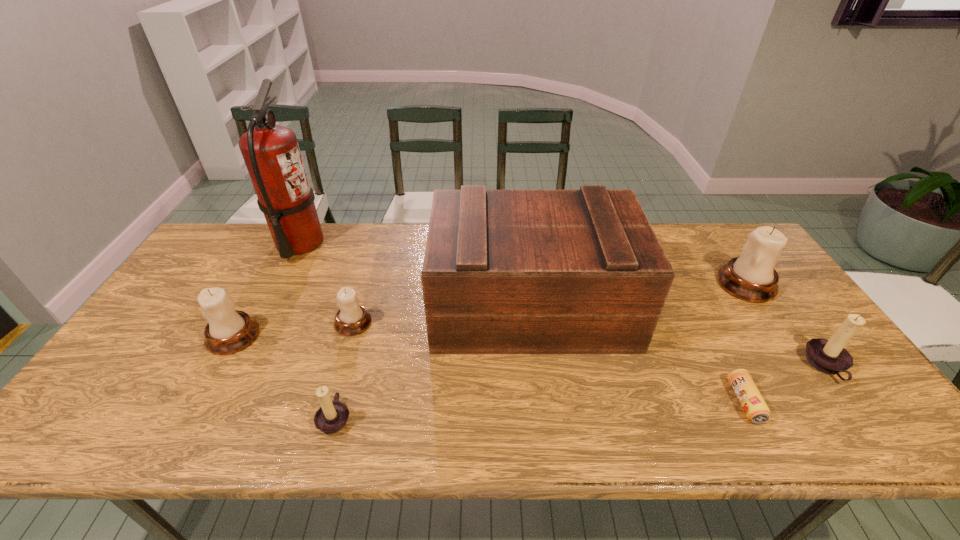
Locate an element on the screen. Image resolution: width=960 pixels, height=540 pixels. object that stands as the fifth closest to the farthest white candle holder is located at coordinates (331, 417).

Locate an element on the screen. Image resolution: width=960 pixels, height=540 pixels. candle holder that is the fourth closest one to the leftmost white candle holder is located at coordinates (829, 356).

The width and height of the screenshot is (960, 540). I want to click on candle holder identified as the fifth closest to the second tallest object, so click(x=228, y=331).

In order to click on white candle holder object that ranks as the second closest to the farthest object in this screenshot , I will do `click(352, 319)`.

At what (x,y) coordinates should I click in order to perform the action: click on white candle holder that is the second closest to the second biggest white candle holder. Please return your answer as a coordinate pair (x, y). The width and height of the screenshot is (960, 540). Looking at the image, I should click on (751, 277).

Locate an element on the screen. Image resolution: width=960 pixels, height=540 pixels. vacant region that satisfies the following two spatial constraints: 1. toward the nozzle of the box; 2. on the right side of the farthest object is located at coordinates (267, 306).

Find the location of a particular element. free space that satisfies the following two spatial constraints: 1. toward the nozzle of the smallest white candle holder; 2. on the right side of the red fire extinguisher is located at coordinates (258, 323).

This screenshot has height=540, width=960. I want to click on vacant space that satisfies the following two spatial constraints: 1. toward the nozzle of the box; 2. on the left side of the red fire extinguisher, so click(267, 306).

Where is `free space that satisfies the following two spatial constraints: 1. toward the nozzle of the tallest object; 2. on the back side of the smallest white candle holder`? The image size is (960, 540). free space that satisfies the following two spatial constraints: 1. toward the nozzle of the tallest object; 2. on the back side of the smallest white candle holder is located at coordinates (258, 323).

Locate an element on the screen. The height and width of the screenshot is (540, 960). free space that satisfies the following two spatial constraints: 1. toward the nozzle of the fire extinguisher; 2. on the back side of the rightmost white candle holder is located at coordinates (278, 284).